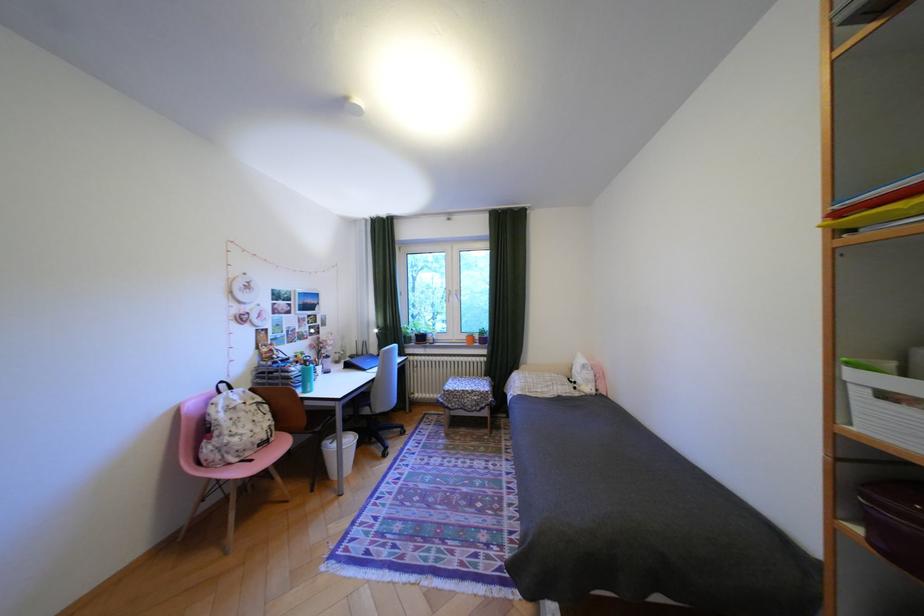
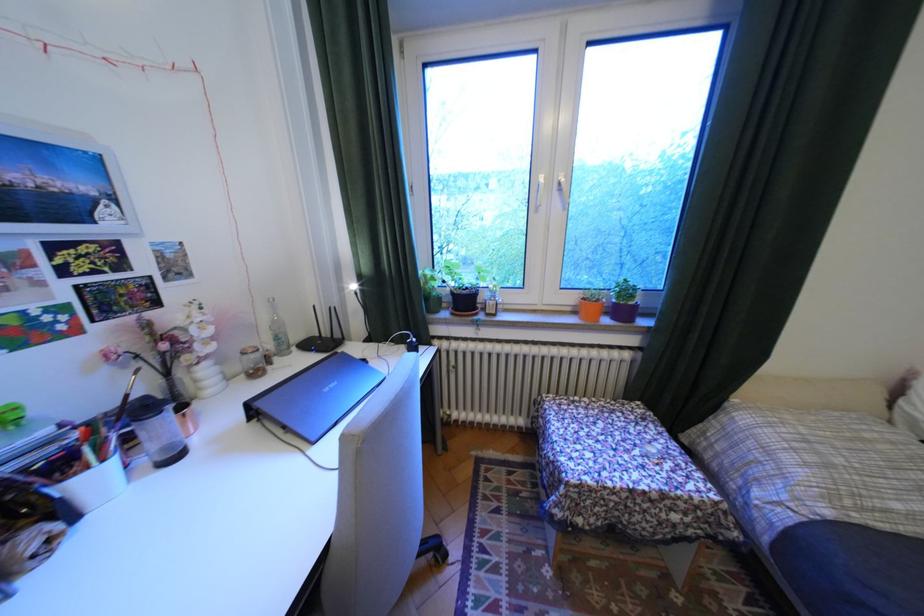
Question: In a continuous first-person perspective shot, in which direction is the camera moving?

Choices:
 (A) Left
 (B) Right
 (C) Forward
 (D) Backward

Answer: (C)